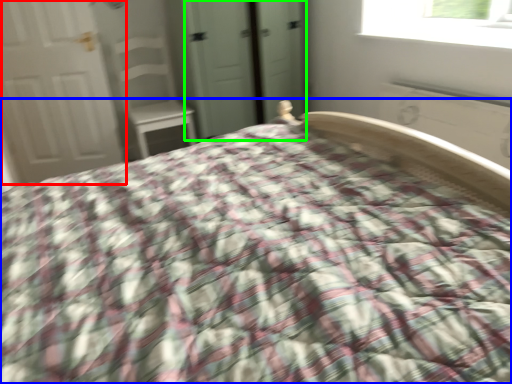
Question: Which is nearer to the door (highlighted by a red box)? bed (highlighted by a blue box) or screen door (highlighted by a green box).

Choices:
 (A) bed
 (B) screen door

Answer: (B)